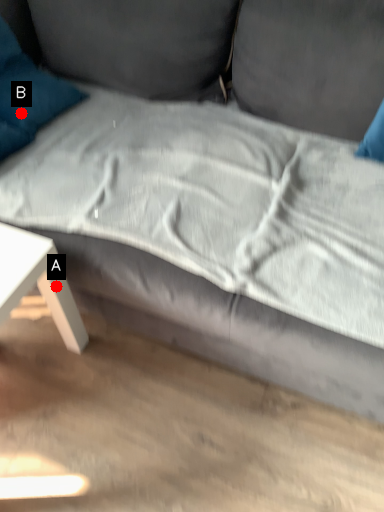
Question: Two points are circled on the image, labeled by A and B beside each circle. Which point is closer to the camera taking this photo?

Choices:
 (A) A is closer
 (B) B is closer

Answer: (A)